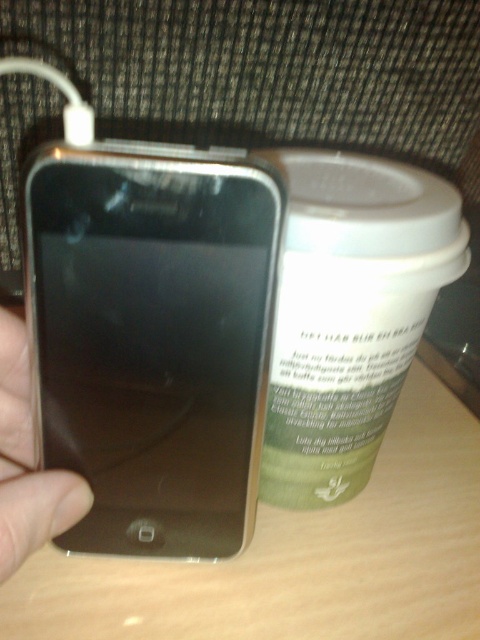
You are trying to place both the satin gold ipod at left and the metallic silver phone at left into a small pouch that can only fit one item. Based on their sizes, which one is more likely to fit?

The metallic silver phone at left is more likely to fit into the small pouch because the satin gold ipod at left might be wider than it.

You are a delivery robot with a 3 inch wide package. You need to navigate between the satin gold ipod at left and the metallic silver phone at left. Can you fit through the space between them?

The distance between the satin gold ipod at left and the metallic silver phone at left is 2.86 inches, which is narrower than the 3 inch wide package. Therefore, the package cannot fit through the space between them.